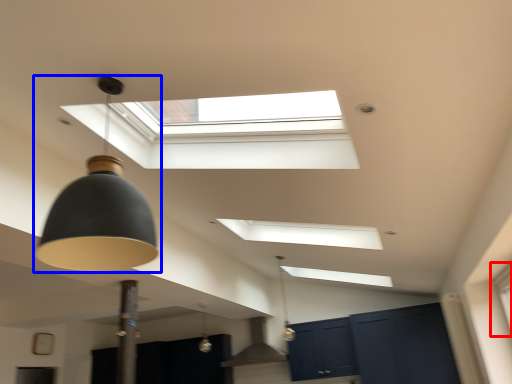
Question: Among these objects, which one is nearest to the camera, window (highlighted by a red box) or lamp (highlighted by a blue box)?

Choices:
 (A) window
 (B) lamp

Answer: (B)